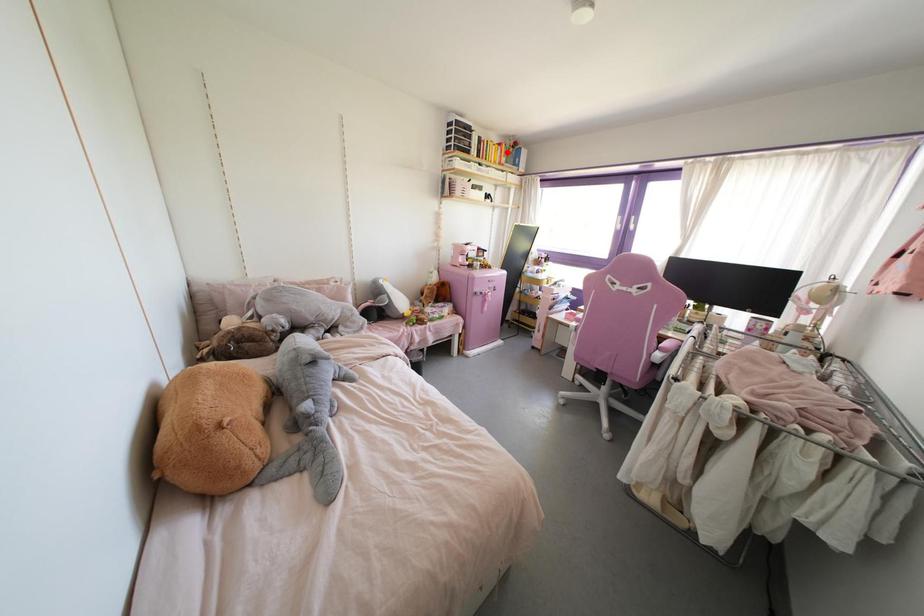
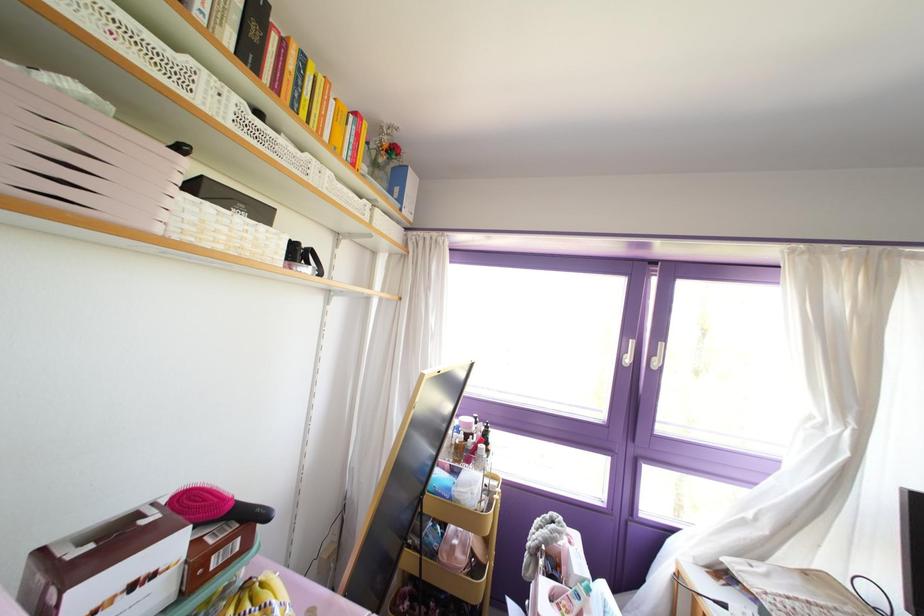
Where in the second image is the point corresponding to the highlighted location from the first image?

(372, 163)